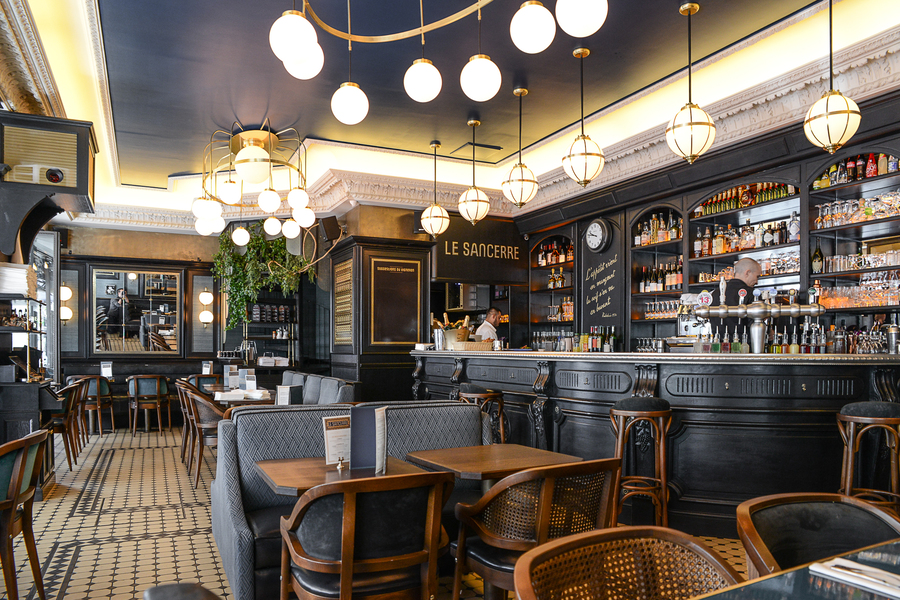
Image resolution: width=900 pixels, height=600 pixels. What are the coordinates of `white ceiling globe lights-lined` in the screenshot? It's located at coord(436,216), coord(474,202), coord(528,183), coord(586,169), coord(703,129), coord(829,135).